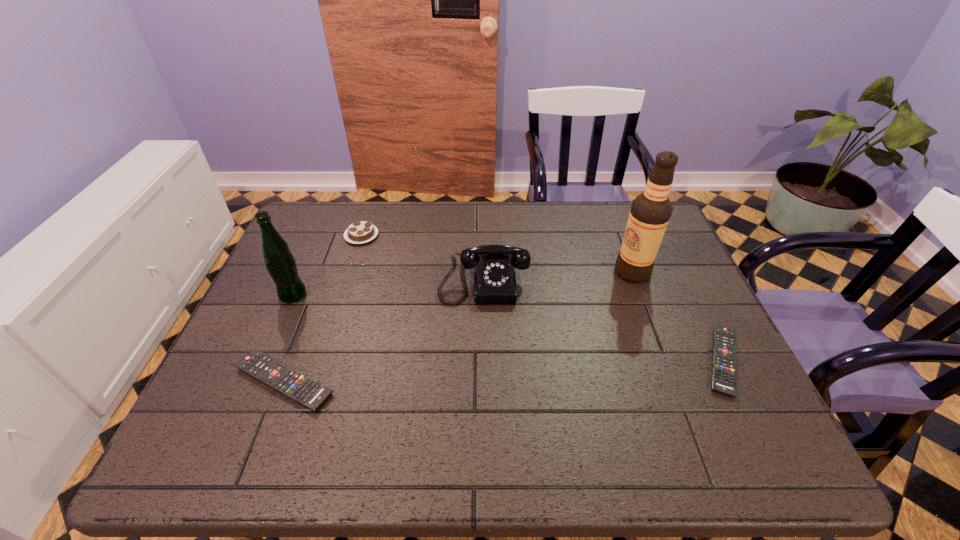
Where is `vacant space at the far right corner`? vacant space at the far right corner is located at coordinates (623, 202).

The width and height of the screenshot is (960, 540). What are the coordinates of `vacant area between the farthest object and the telephone` in the screenshot? It's located at point(422,258).

Identify the location of vacant area that lies between the taller remote control and the third object from right to left. (384, 330).

At what (x,y) coordinates should I click in order to perform the action: click on vacant space in between the third tallest object and the tallest object. Please return your answer as a coordinate pair (x, y). Image resolution: width=960 pixels, height=540 pixels. Looking at the image, I should click on point(558,275).

Where is `vacant space that is in between the farthest object and the rightmost object`? vacant space that is in between the farthest object and the rightmost object is located at coordinates (542, 298).

Where is `free spot between the shorter remote control and the second object from right to left`? The image size is (960, 540). free spot between the shorter remote control and the second object from right to left is located at coordinates (678, 316).

You are a GUI agent. You are given a task and a screenshot of the screen. Output one action in this format:
    pyautogui.click(x=<x>, y=<y>)
    Task: Click on the vacant area that lies between the third shortest object and the fourth object from left to right
    
    Given the screenshot: What is the action you would take?
    pyautogui.click(x=422, y=258)

Find the location of a particular element. The width and height of the screenshot is (960, 540). vacant area between the third tallest object and the right remote control is located at coordinates (603, 320).

Find the location of a particular element. The image size is (960, 540). vacant area that lies between the taller remote control and the fifth object from left to right is located at coordinates (458, 327).

This screenshot has height=540, width=960. What are the coordinates of `empty location between the left remote control and the farthest object` in the screenshot? It's located at (323, 308).